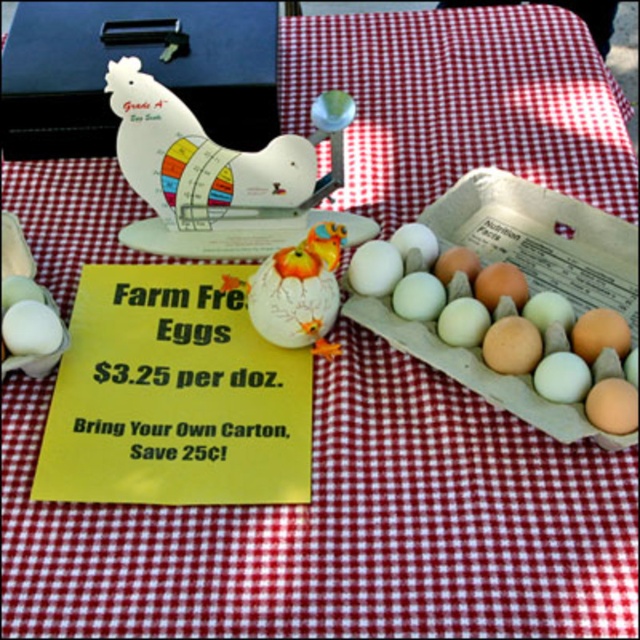
Does white matte egg at lower left have a larger size compared to white matte egg at center?

No, white matte egg at lower left is not bigger than white matte egg at center.

Does white matte egg at lower left come in front of white matte egg at center?

Yes, it is.

You are a GUI agent. You are given a task and a screenshot of the screen. Output one action in this format:
    pyautogui.click(x=<x>, y=<y>)
    Task: Click on the white matte egg at lower left
    Image resolution: width=640 pixels, height=640 pixels.
    Given the screenshot: What is the action you would take?
    pyautogui.click(x=32, y=328)

Identify the location of white matte egg at lower left. (32, 328).

Consider the image. Can you confirm if wooden at upper center is shorter than matte plastic chicken at center?

Incorrect, wooden at upper center's height does not fall short of matte plastic chicken at center's.

Does point (188, 166) lie behind point (317, 275)?

That is True.

This screenshot has height=640, width=640. Find the location of `wooden at upper center`. wooden at upper center is located at coordinates (218, 156).

Looking at this image, how distant is matte plastic chicken at center from white matte egg at lower left?

matte plastic chicken at center and white matte egg at lower left are 8.35 inches apart.

I want to click on matte plastic chicken at center, so click(x=298, y=291).

Where is `matte plastic chicken at center`? The image size is (640, 640). matte plastic chicken at center is located at coordinates (298, 291).